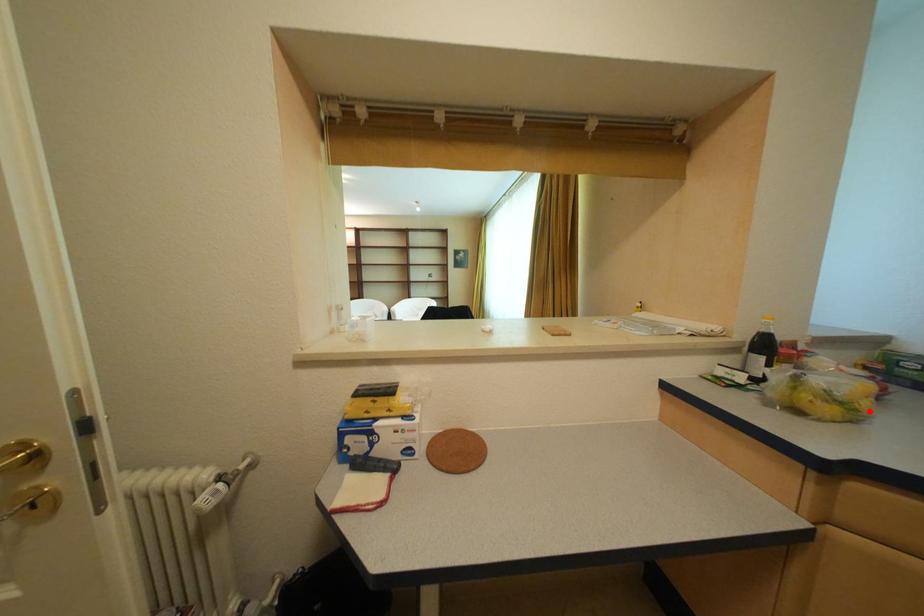
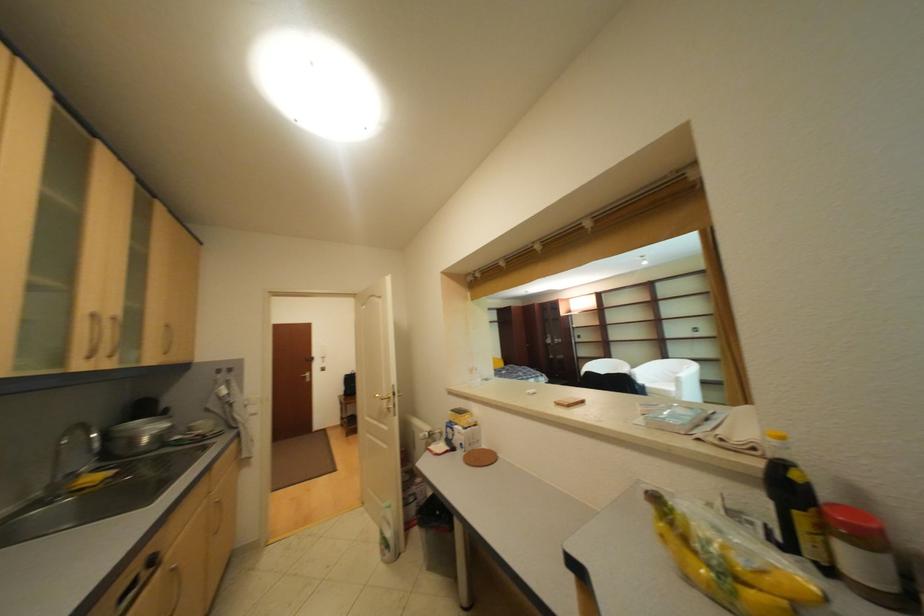
Question: I am providing you with two images of the same scene from different viewpoints. A red point is marked on the first image. At the location where the point appears in image 1, is it still visible in image 2?

Choices:
 (A) Yes
 (B) No

Answer: (A)